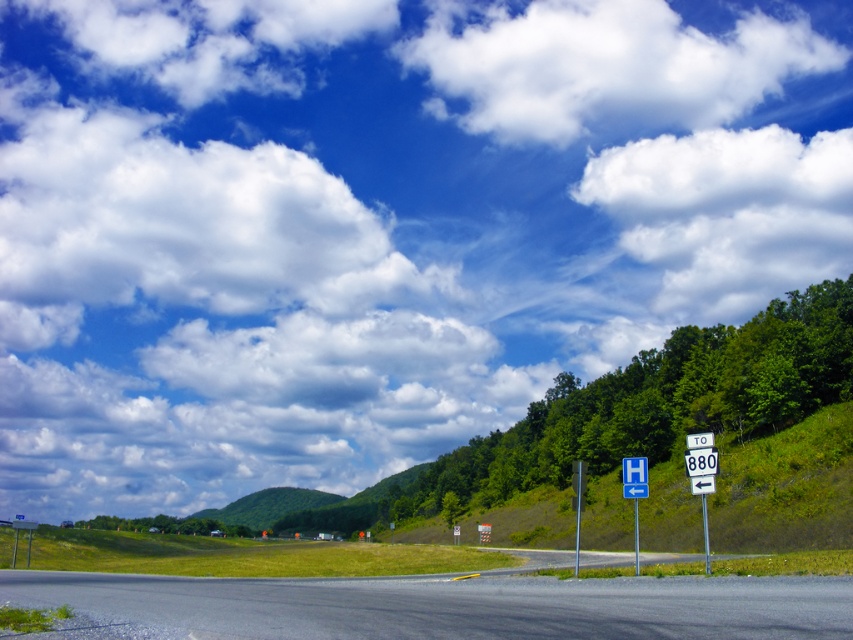
Question: Which object appears closest to the camera in this image?

Choices:
 (A) metallic signpost at right
 (B) blue plastic sign at upper center

Answer: (A)

Question: Does asphalt road at lower center appear over metallic signpost at right?

Choices:
 (A) no
 (B) yes

Answer: (B)

Question: Is blue plastic sign at upper center to the left of blue metallic signpost at upper center from the viewer's perspective?

Choices:
 (A) yes
 (B) no

Answer: (A)

Question: Based on their relative distances, which object is farther from the blue metallic signpost at upper center?

Choices:
 (A) white fluffy cloud at upper center
 (B) white plastic sign at center right
 (C) blue plastic sign at upper center

Answer: (A)

Question: Considering the relative positions of blue plastic sign at upper center and metallic signpost at right in the image provided, where is blue plastic sign at upper center located with respect to metallic signpost at right?

Choices:
 (A) right
 (B) left

Answer: (B)

Question: Which of the following is the farthest from the observer?

Choices:
 (A) white fluffy cloud at upper center
 (B) metallic signpost at right

Answer: (A)